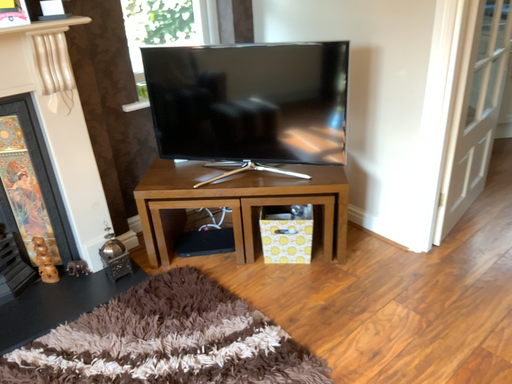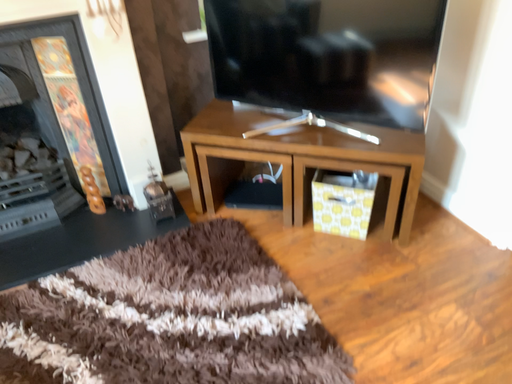
Question: How did the camera likely rotate when shooting the video?

Choices:
 (A) rotated right
 (B) rotated left

Answer: (B)